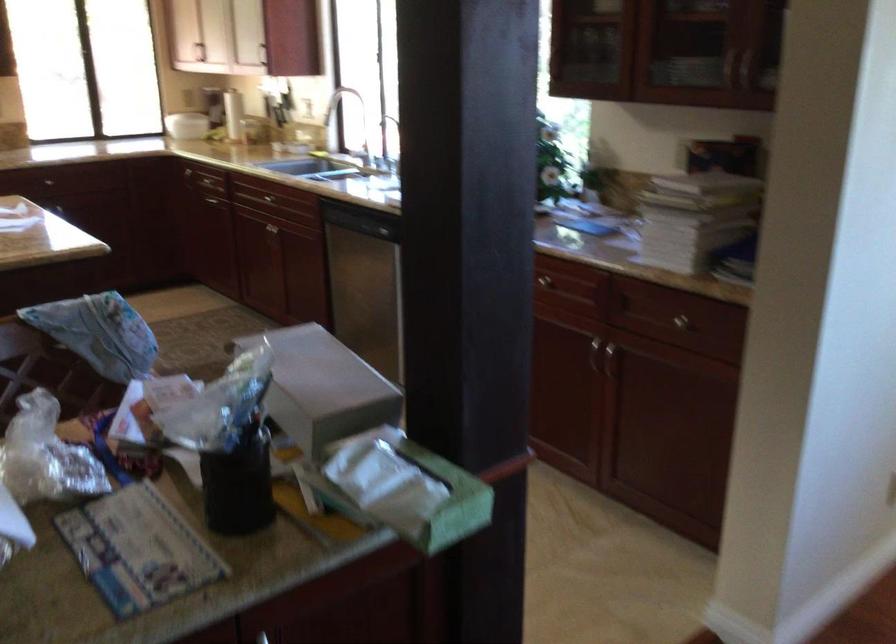
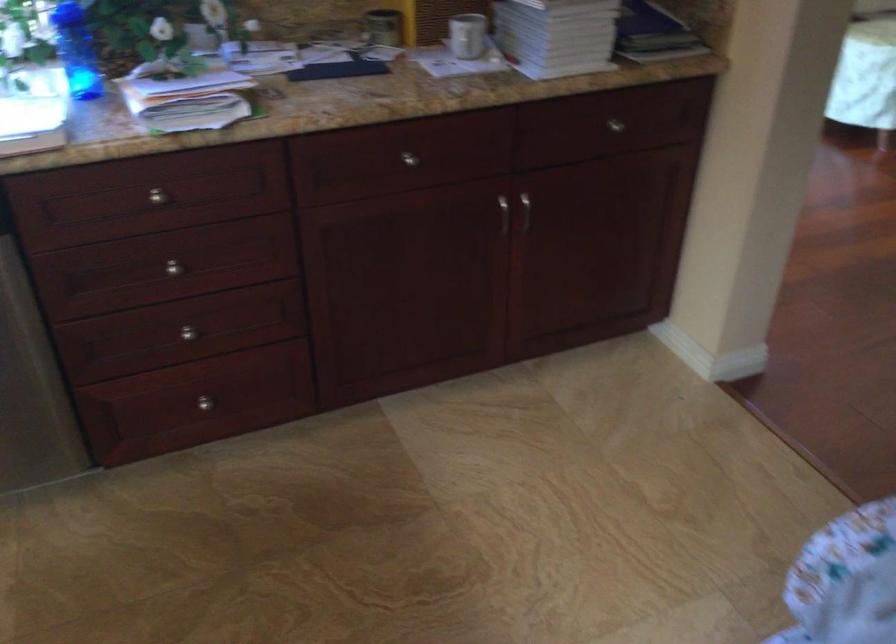
The point at (684, 324) is marked in the first image. Where is the corresponding point in the second image?

(615, 125)